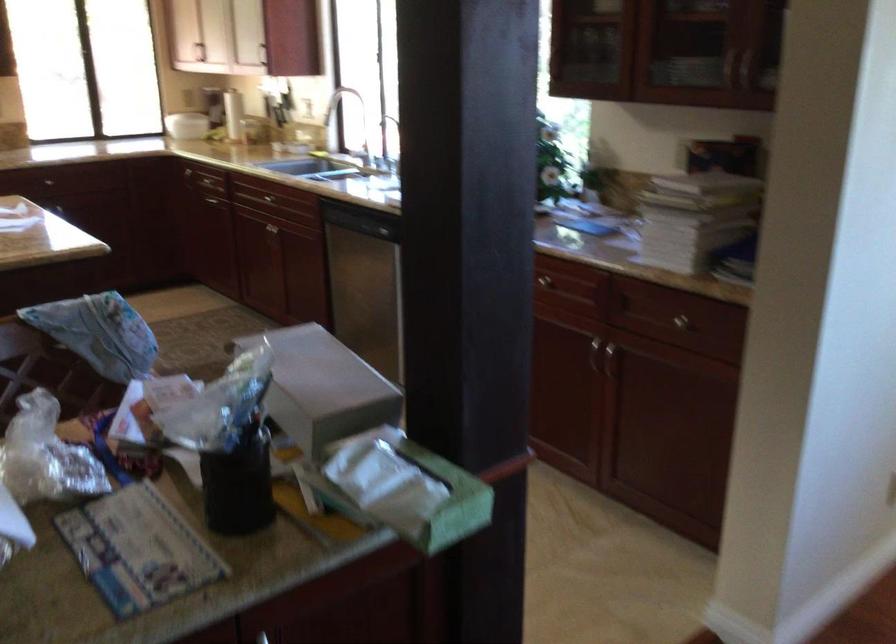
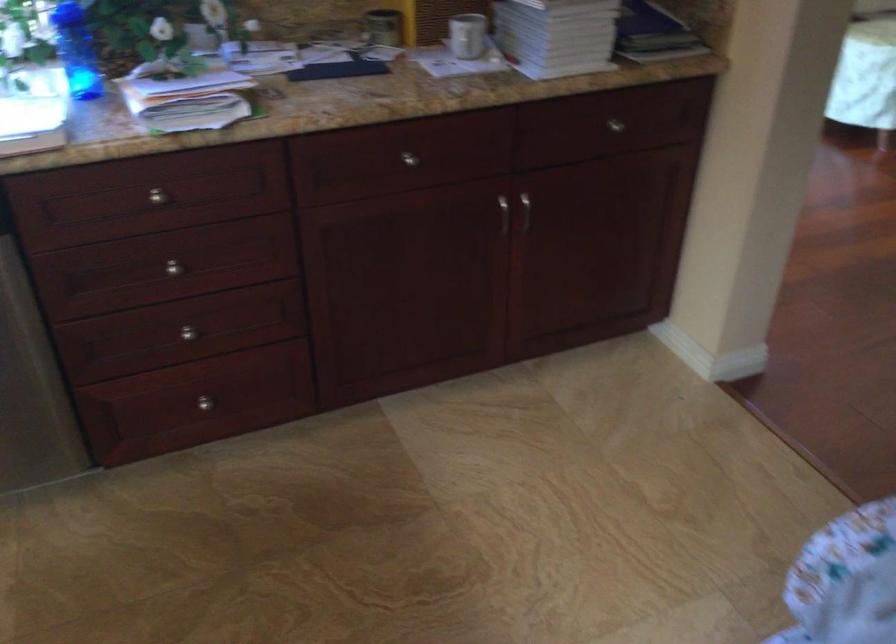
The point at (684, 324) is marked in the first image. Where is the corresponding point in the second image?

(615, 125)